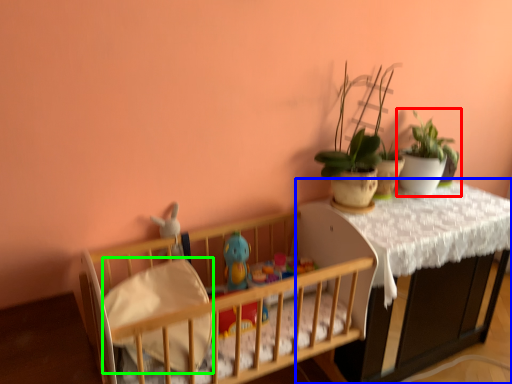
Question: Considering the real-world distances, which object is farthest from houseplant (highlighted by a red box)? table (highlighted by a blue box) or sheet (highlighted by a green box)?

Choices:
 (A) table
 (B) sheet

Answer: (B)